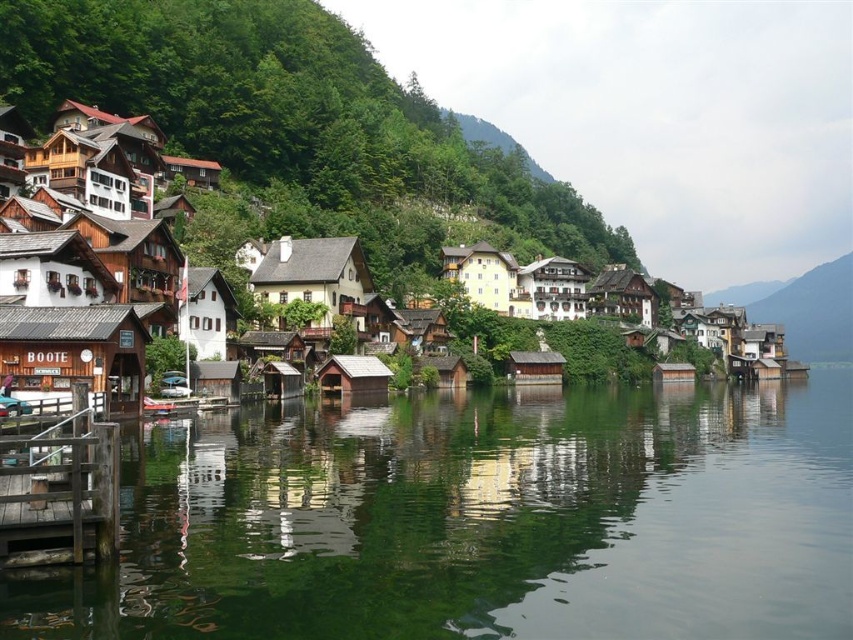
Who is more distant from viewer, (328, 445) or (752, 314)?

Point (752, 314)

Is point (815, 634) positioned before point (817, 330)?

Yes.

At what (x,y) coordinates should I click in order to perform the action: click on green reflective water at lower center. Please return your answer as a coordinate pair (x, y). This screenshot has height=640, width=853. Looking at the image, I should click on (480, 520).

Which is below, green reflective water at lower center or wooden houses at center?

green reflective water at lower center is below.

At what (x,y) coordinates should I click in order to perform the action: click on green reflective water at lower center. Please return your answer as a coordinate pair (x, y). The image size is (853, 640). Looking at the image, I should click on (480, 520).

The height and width of the screenshot is (640, 853). What are the coordinates of `green reflective water at lower center` in the screenshot? It's located at (480, 520).

Does wooden dock at lower left have a lesser height compared to wooden cabin at center right?

Yes, wooden dock at lower left is shorter than wooden cabin at center right.

Does wooden dock at lower left appear on the left side of wooden cabin at center right?

Indeed, wooden dock at lower left is positioned on the left side of wooden cabin at center right.

Does point (78, 524) come behind point (807, 353)?

No, it is not.

Find the location of a particular element. This screenshot has width=853, height=640. wooden dock at lower left is located at coordinates (59, 493).